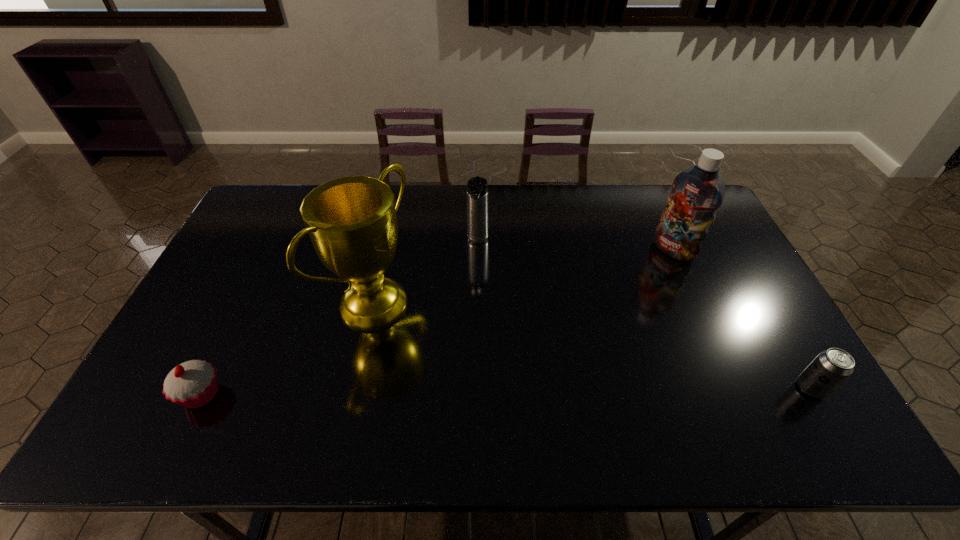
Image resolution: width=960 pixels, height=540 pixels. Identify the location of vacant area between the third object from right to left and the rightmost object. (644, 315).

Where is `vacant point located between the beer can and the cupcake`? The width and height of the screenshot is (960, 540). vacant point located between the beer can and the cupcake is located at coordinates [506, 391].

I want to click on free space between the third shortest object and the cupcake, so click(340, 318).

Where is `free space between the rightmost object and the shampoo`? This screenshot has height=540, width=960. free space between the rightmost object and the shampoo is located at coordinates click(x=742, y=319).

In order to click on free space between the rightmost object and the third shortest object in this screenshot , I will do `click(644, 315)`.

In order to click on vacant area between the cupcake and the second object from left to right in this screenshot , I will do `click(288, 348)`.

What are the coordinates of `free space between the beer can and the cupcake` in the screenshot? It's located at (506, 391).

Find the location of a particular element. free spot between the fourth object from right to left and the cupcake is located at coordinates (288, 348).

Where is `empty space between the third shortest object and the rightmost object`? The height and width of the screenshot is (540, 960). empty space between the third shortest object and the rightmost object is located at coordinates (644, 315).

Locate an element on the screen. vacant space in between the rightmost object and the award is located at coordinates (592, 346).